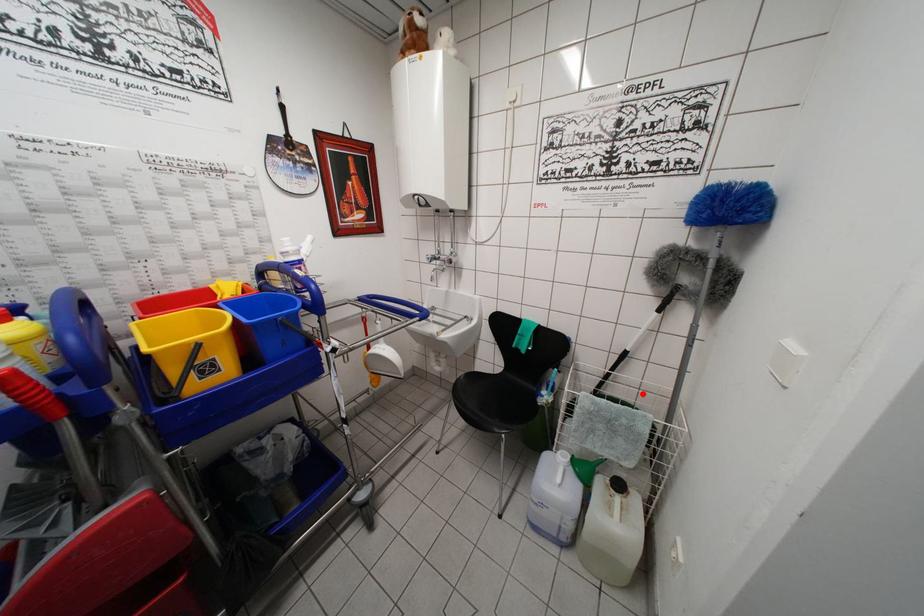
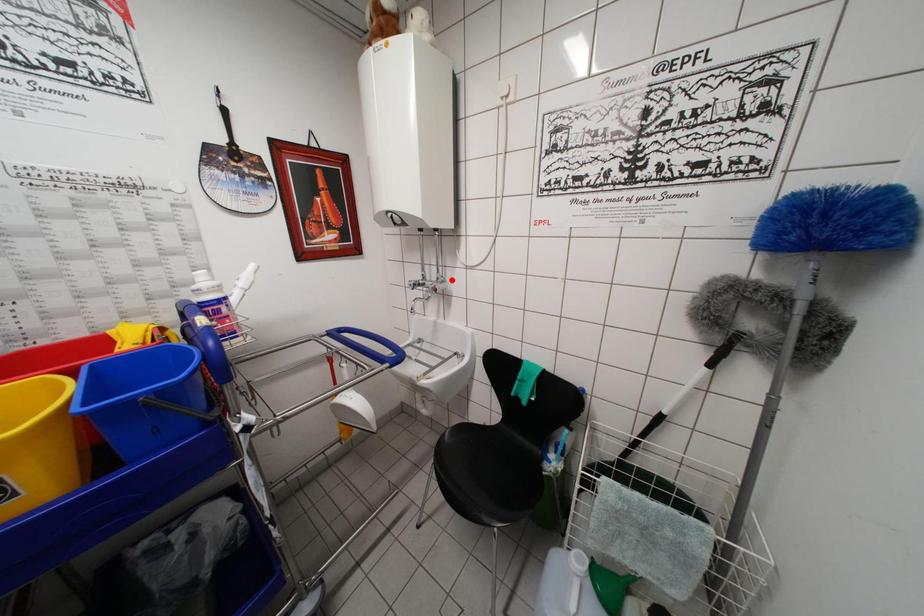
I am providing you with two images of the same scene from different viewpoints. A red point is marked on the first image and another point is marked on the second image. Is the red point in image1 aligned with the point shown in image2?

No